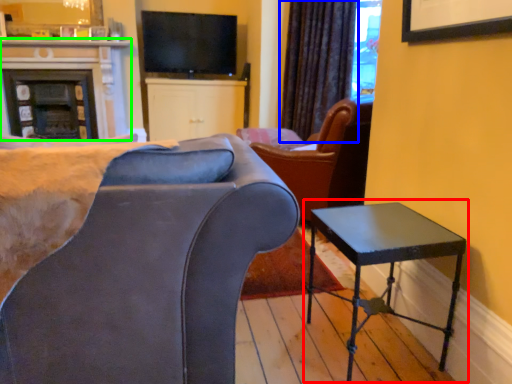
Question: Considering the real-world distances, which object is closest to table (highlighted by a red box)? curtain (highlighted by a blue box) or fireplace (highlighted by a green box).

Choices:
 (A) curtain
 (B) fireplace

Answer: (A)